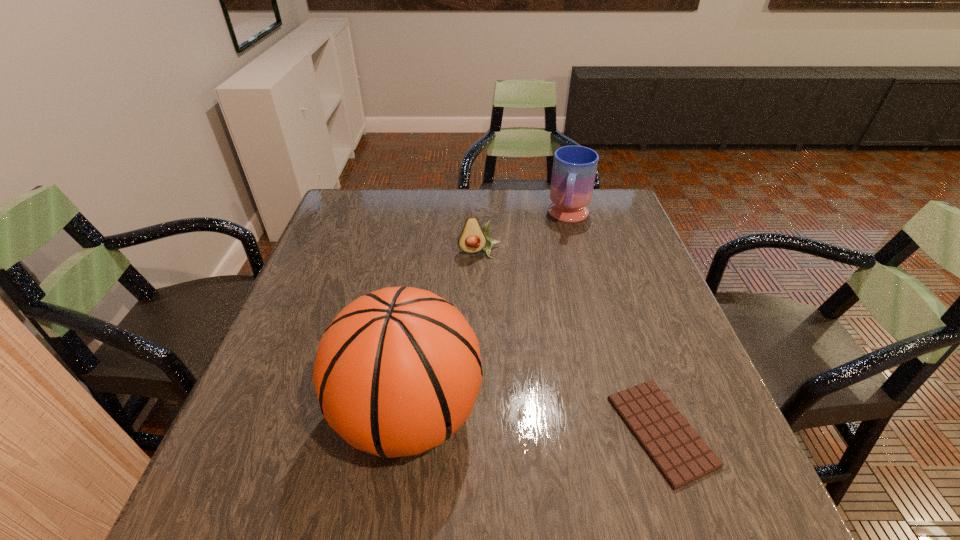
Locate an element on the screen. The height and width of the screenshot is (540, 960). free space between the tallest object and the second tallest object is located at coordinates (490, 316).

At what (x,y) coordinates should I click in order to perform the action: click on unoccupied area between the chocolate bar and the farthest object. Please return your answer as a coordinate pair (x, y). This screenshot has width=960, height=540. Looking at the image, I should click on (615, 324).

Where is `empty location between the basketball and the third shortest object`? empty location between the basketball and the third shortest object is located at coordinates (490, 316).

I want to click on free space that is in between the tallest object and the chocolate bar, so click(535, 423).

The height and width of the screenshot is (540, 960). I want to click on unoccupied position between the second tallest object and the tallest object, so click(490, 316).

Find the location of a particular element. the third closest object to the shortest object is located at coordinates coord(574,170).

The image size is (960, 540). I want to click on object that ranks as the third closest to the avocado, so click(680, 454).

Find the location of a particular element. This screenshot has width=960, height=540. free space that satisfies the following two spatial constraints: 1. on the front side of the shortest object; 2. on the right side of the second tallest object is located at coordinates (629, 431).

I want to click on free location that satisfies the following two spatial constraints: 1. on the front side of the farthest object; 2. on the right side of the chocolate bar, so click(x=629, y=431).

At what (x,y) coordinates should I click in order to perform the action: click on vacant point that satisfies the following two spatial constraints: 1. on the back side of the basketball; 2. on the left side of the avocado. Please return your answer as a coordinate pair (x, y). The image size is (960, 540). Looking at the image, I should click on (431, 252).